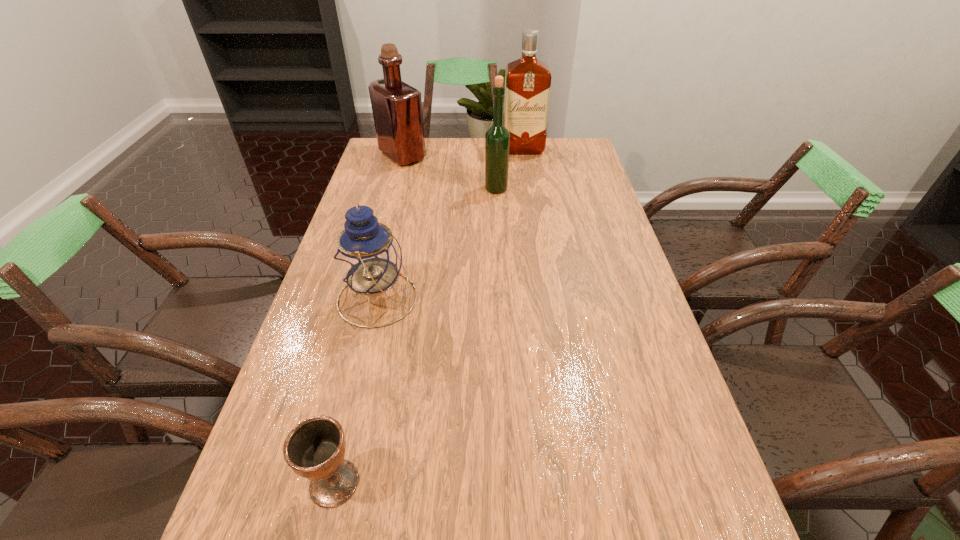
Find the location of a particular element. Image resolution: width=960 pixels, height=540 pixels. object identified as the closest to the third farthest object is located at coordinates (527, 80).

Identify the location of the closest liquor relative to the fourth farthest object. This screenshot has height=540, width=960. (497, 138).

The width and height of the screenshot is (960, 540). Identify the location of the closest liquor to the leftmost liquor. (497, 138).

Locate an element on the screen. The width and height of the screenshot is (960, 540). vacant point that satisfies the following two spatial constraints: 1. on the front-facing side of the second shortest object; 2. on the left side of the shortest object is located at coordinates (334, 483).